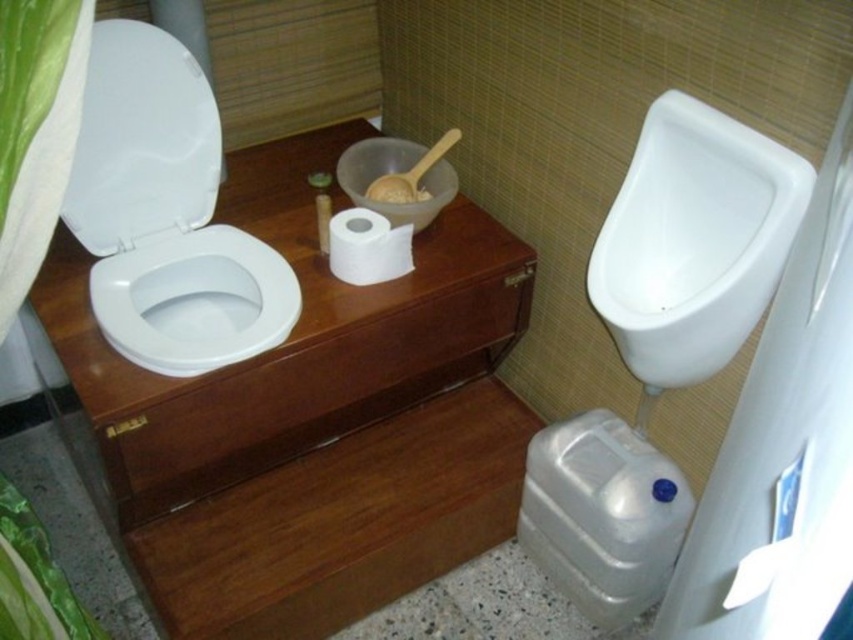
Question: Which point is closer to the camera taking this photo?

Choices:
 (A) (299, 310)
 (B) (131, 68)
 (C) (126, 444)

Answer: (C)

Question: Which object is positioned farthest from the white matte toilet paper at center?

Choices:
 (A) white glossy toilet lid at upper left
 (B) white matte bowl at center
 (C) wooden dresser at center

Answer: (A)

Question: Does wooden drawer at center appear on the left side of white matte bowl at center?

Choices:
 (A) yes
 (B) no

Answer: (A)

Question: Estimate the real-world distances between objects in this image. Which object is closer to the wooden dresser at center?

Choices:
 (A) white matte bowl at center
 (B) white glossy urinal at right
 (C) white glossy toilet lid at upper left

Answer: (C)

Question: Is wooden drawer at center positioned at the back of white glossy urinal at right?

Choices:
 (A) no
 (B) yes

Answer: (B)

Question: Does white glossy toilet bowl at left appear on the left side of white matte bowl at center?

Choices:
 (A) yes
 (B) no

Answer: (A)